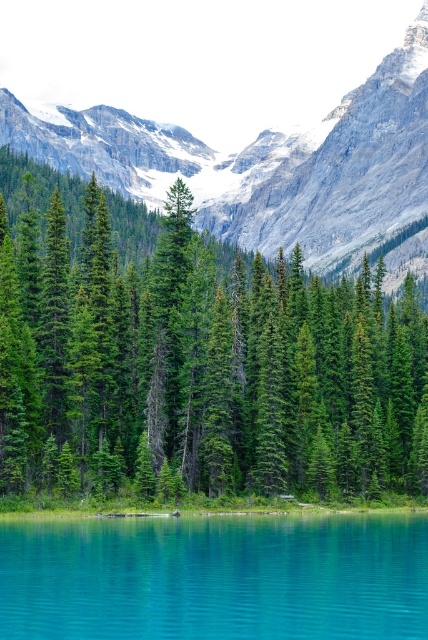
Which is more to the left, green matte pine forest at center or rocky gray mountain at upper center?

From the viewer's perspective, green matte pine forest at center appears more on the left side.

Where is `green matte pine forest at center`? The width and height of the screenshot is (428, 640). green matte pine forest at center is located at coordinates (196, 362).

In order to click on green matte pine forest at center in this screenshot , I will do `click(196, 362)`.

Which is below, rocky gray mountain at upper center or turquoise glassy water at lower center?

Positioned lower is turquoise glassy water at lower center.

Is point (338, 166) positioned after point (234, 602)?

Yes, it is behind point (234, 602).

Locate an element on the screen. Image resolution: width=428 pixels, height=640 pixels. rocky gray mountain at upper center is located at coordinates (265, 163).

Between green matte pine forest at center and turquoise glassy water at lower center, which one has more height?

green matte pine forest at center

Who is positioned more to the left, green matte pine forest at center or turquoise glassy water at lower center?

green matte pine forest at center

Is point (318, 412) behind point (371, 577)?

Yes, point (318, 412) is behind point (371, 577).

Locate an element on the screen. This screenshot has width=428, height=640. green matte pine forest at center is located at coordinates (196, 362).